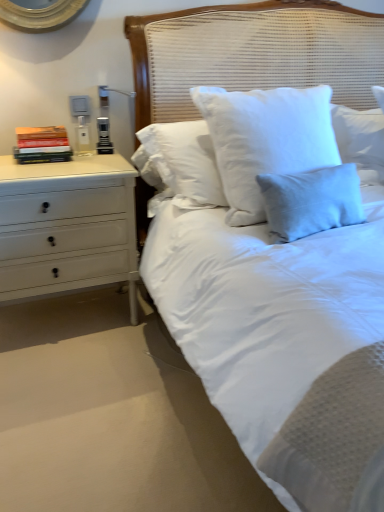
Locate an element on the screen. The image size is (384, 512). free point in front of hardcover books at left is located at coordinates (39, 168).